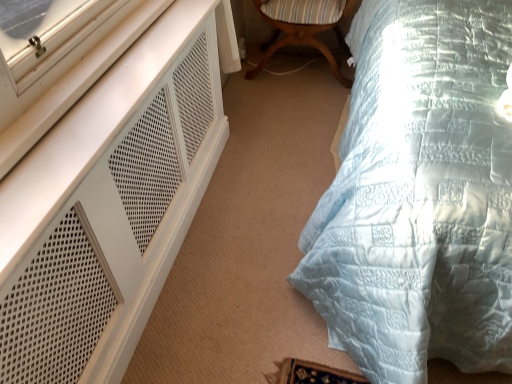
Question: From the image's perspective, would you say light blue quilted bed at right is shown under white mesh dresser at left?

Choices:
 (A) yes
 (B) no

Answer: (B)

Question: From a real-world perspective, is light blue quilted bed at right positioned over white mesh dresser at left based on gravity?

Choices:
 (A) no
 (B) yes

Answer: (B)

Question: Is white mesh dresser at left a part of light blue quilted bed at right?

Choices:
 (A) no
 (B) yes

Answer: (A)

Question: Does light blue quilted bed at right touch white mesh dresser at left?

Choices:
 (A) no
 (B) yes

Answer: (A)

Question: Are light blue quilted bed at right and white mesh dresser at left far apart?

Choices:
 (A) no
 (B) yes

Answer: (A)

Question: In the image, is light blue quilted bed at right positioned in front of or behind wooden striped cushion at center?

Choices:
 (A) front
 (B) behind

Answer: (A)

Question: From a real-world perspective, is light blue quilted bed at right positioned above or below wooden striped cushion at center?

Choices:
 (A) above
 (B) below

Answer: (A)

Question: Considering the relative positions of light blue quilted bed at right and wooden striped cushion at center in the image provided, is light blue quilted bed at right to the left or to the right of wooden striped cushion at center?

Choices:
 (A) right
 (B) left

Answer: (A)

Question: Do you think light blue quilted bed at right is within wooden striped cushion at center, or outside of it?

Choices:
 (A) inside
 (B) outside

Answer: (B)

Question: From a real-world perspective, relative to light blue quilted bed at right, is white mesh dresser at left vertically above or below?

Choices:
 (A) below
 (B) above

Answer: (A)

Question: From the image's perspective, is white mesh dresser at left above or below light blue quilted bed at right?

Choices:
 (A) above
 (B) below

Answer: (B)

Question: In terms of height, does white mesh dresser at left look taller or shorter compared to light blue quilted bed at right?

Choices:
 (A) short
 (B) tall

Answer: (A)

Question: Is white mesh dresser at left wider or thinner than light blue quilted bed at right?

Choices:
 (A) thin
 (B) wide

Answer: (A)

Question: In terms of width, does wooden striped cushion at center look wider or thinner when compared to white mesh dresser at left?

Choices:
 (A) thin
 (B) wide

Answer: (B)

Question: Which is correct: wooden striped cushion at center is inside white mesh dresser at left, or outside of it?

Choices:
 (A) outside
 (B) inside

Answer: (A)